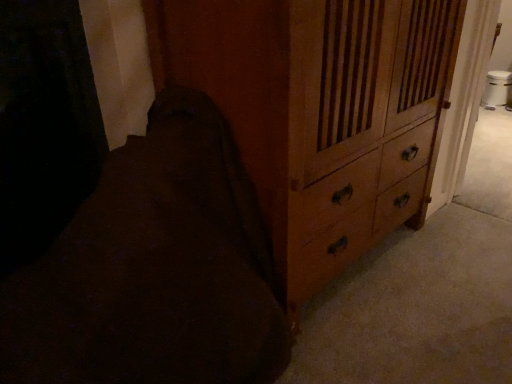
Question: Visually, is dark brown fabric at lower left positioned to the left or to the right of wooden chest of drawers at center-right?

Choices:
 (A) right
 (B) left

Answer: (B)

Question: Is point click(x=96, y=301) closer or farther from the camera than point click(x=312, y=1)?

Choices:
 (A) closer
 (B) farther

Answer: (B)

Question: Choose the correct answer: Is dark brown fabric at lower left inside wooden chest of drawers at center-right or outside it?

Choices:
 (A) inside
 (B) outside

Answer: (B)

Question: Relative to dark brown fabric at lower left, is wooden chest of drawers at center-right in front or behind?

Choices:
 (A) front
 (B) behind

Answer: (B)

Question: Looking at their shapes, would you say wooden chest of drawers at center-right is wider or thinner than dark brown fabric at lower left?

Choices:
 (A) wide
 (B) thin

Answer: (B)

Question: Choose the correct answer: Is wooden chest of drawers at center-right inside dark brown fabric at lower left or outside it?

Choices:
 (A) outside
 (B) inside

Answer: (A)

Question: Considering the positions of wooden chest of drawers at center-right and dark brown fabric at lower left in the image, is wooden chest of drawers at center-right bigger or smaller than dark brown fabric at lower left?

Choices:
 (A) small
 (B) big

Answer: (B)